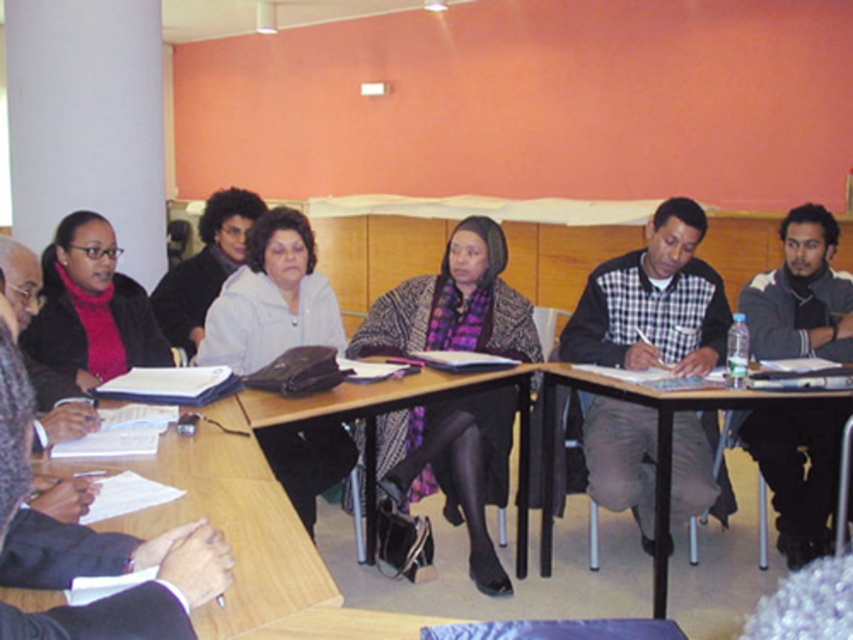
Question: Is checkered fabric shirt at center above matte black jacket at left?

Choices:
 (A) no
 (B) yes

Answer: (A)

Question: Is checkered fabric shirt at center closer to the viewer compared to dark gray sweater at right?

Choices:
 (A) yes
 (B) no

Answer: (B)

Question: From the image, what is the correct spatial relationship of knitted woolen shawl at center in relation to wooden table at lower center?

Choices:
 (A) below
 (B) above

Answer: (B)

Question: Which of the following is the farthest from the observer?

Choices:
 (A) checkered fabric shirt at center
 (B) wooden table at lower center
 (C) matte black jacket at left
 (D) metallic gray table at center

Answer: (A)

Question: Which object is positioned closest to the checkered fabric shirt at center?

Choices:
 (A) wooden table at center
 (B) knitted woolen shawl at center
 (C) metallic gray table at center

Answer: (C)

Question: Estimate the real-world distances between objects in this image. Which object is farther from the checkered fabric shirt at center?

Choices:
 (A) wooden table at center
 (B) white matte jacket at center
 (C) knitted woolen shawl at center

Answer: (B)